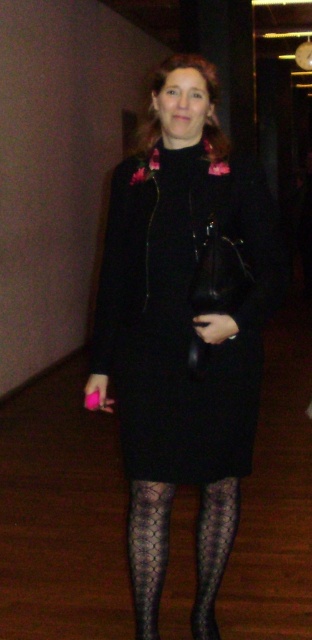
You are a fashion designer analyzing the outfit of a person in an image. The person is wearing a black matte dress at center and black mesh tights at center. Which item is positioned more to the right side of the image?

The black matte dress at center is positioned more to the right side of the image compared to the black mesh tights at center.